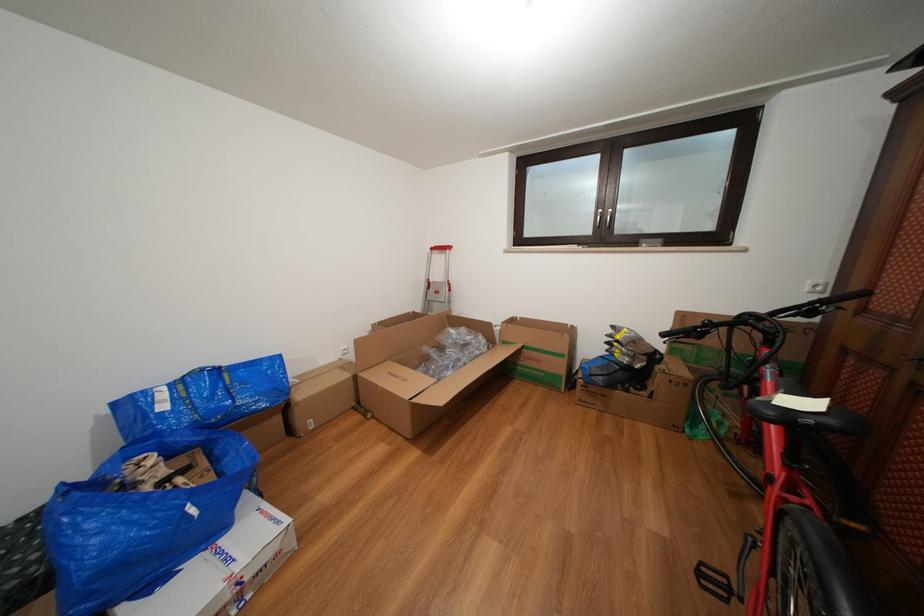
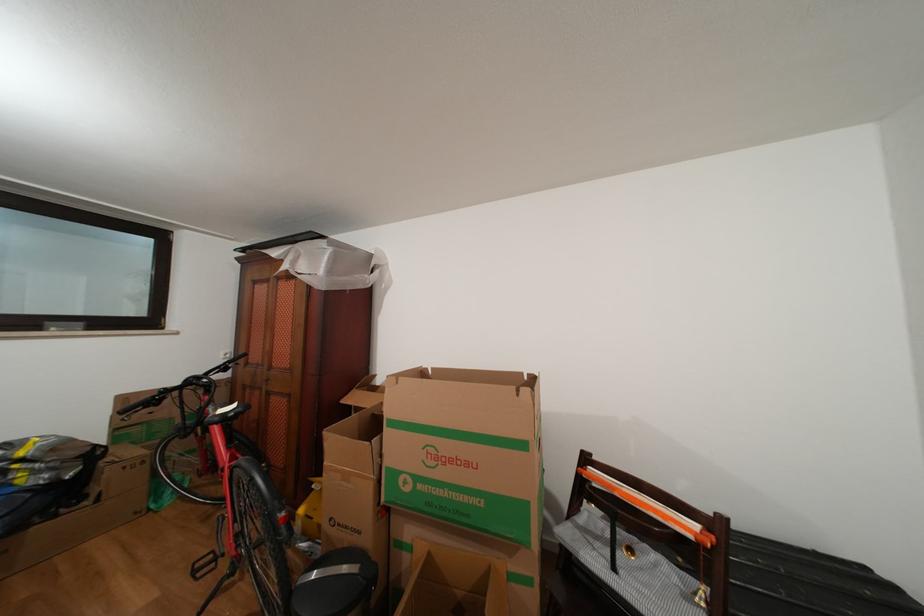
Where in the second image is the point corresponding to point 712,575 from the first image?

(205, 570)